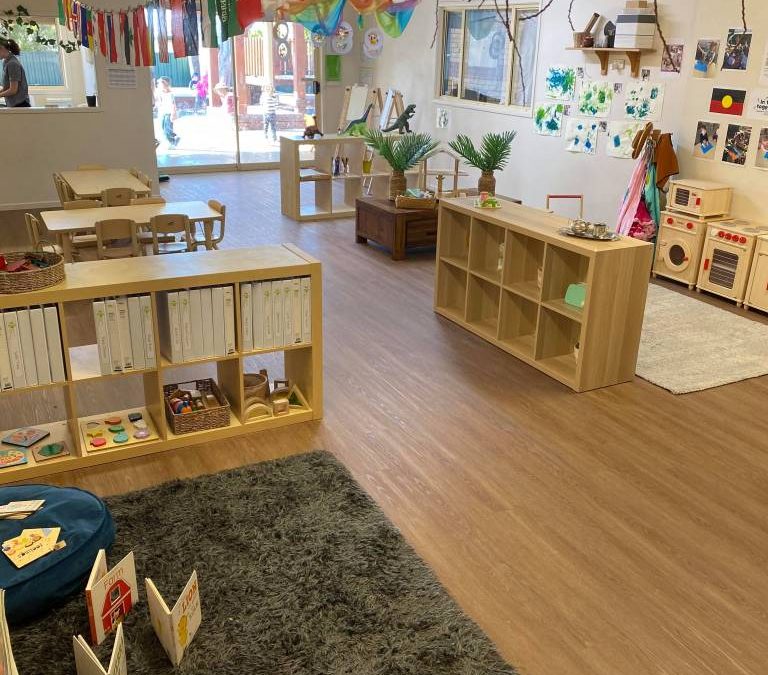
Locate an element on the screen. The height and width of the screenshot is (675, 768). gray rug is located at coordinates (256, 567).